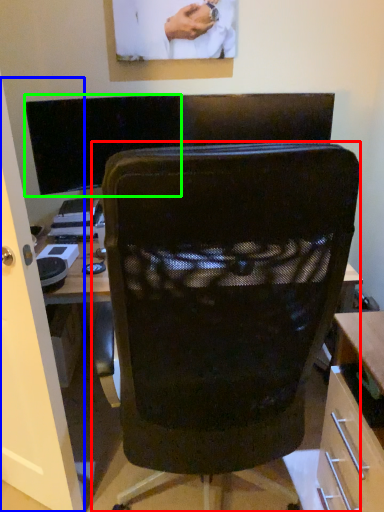
Question: Which is farther away from chair (highlighted by a red box)? glass door (highlighted by a blue box) or computer monitor (highlighted by a green box)?

Choices:
 (A) glass door
 (B) computer monitor

Answer: (B)